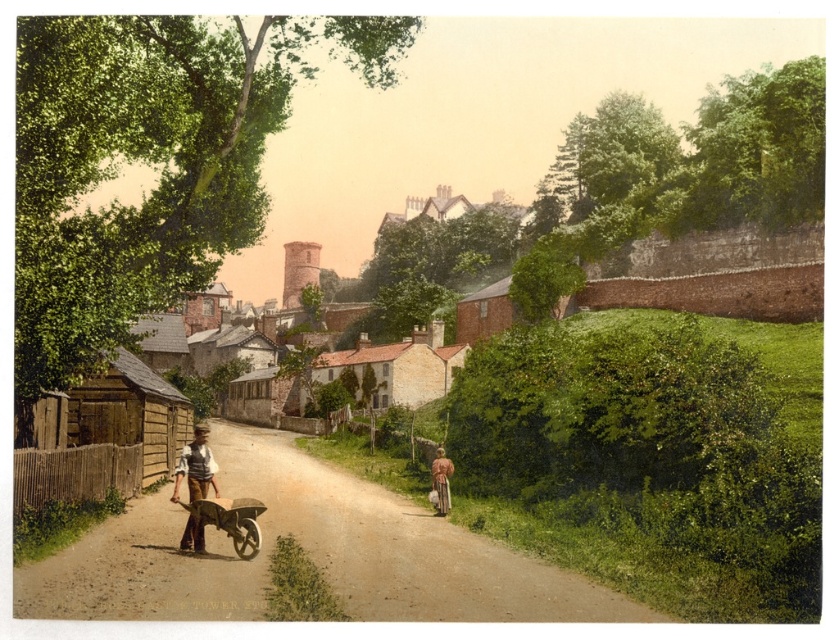
Question: Does brown dirt track at center appear on the right side of wooden wheelbarrow at lower left?

Choices:
 (A) yes
 (B) no

Answer: (B)

Question: Does brown leather pants at left appear on the right side of light brown fabric dress at lower right?

Choices:
 (A) no
 (B) yes

Answer: (A)

Question: Is brown dirt track at center wider than light brown fabric dress at lower right?

Choices:
 (A) yes
 (B) no

Answer: (A)

Question: Which point appears closest to the camera in this image?

Choices:
 (A) (178, 465)
 (B) (258, 500)
 (C) (436, 513)
 (D) (423, 588)

Answer: (D)

Question: Which of the following is the closest to the observer?

Choices:
 (A) light brown fabric dress at lower right
 (B) wooden wheelbarrow at lower left
 (C) brown leather pants at left
 (D) brown dirt track at center

Answer: (D)

Question: Which object appears closest to the camera in this image?

Choices:
 (A) wooden wheelbarrow at lower left
 (B) brown leather pants at left
 (C) light brown fabric dress at lower right

Answer: (A)